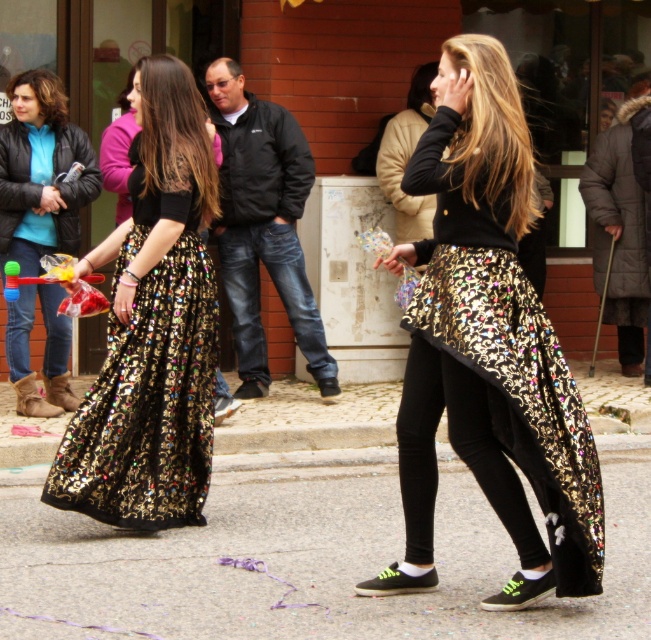
You are a photographer standing at the edge of the street where the shiny asphalt pavement at center is located. You want to take a photo of the festive scene but need to stay 5 meters away from the pavement to avoid disrupting the event. Can you safely take the photo from your current position?

The shiny asphalt pavement at center is 4.52 meters away from the viewer. Since you need to stay 5 meters away, you are currently too close and should move back 0.48 meters to comply with the requirement.

You are a photographer trying to capture both the shiny sequined skirt at center and the shiny metallic skirt at left in a single frame. Which skirt should you focus on first to ensure both are in the frame?

You should focus on the shiny metallic skirt at left first because it is positioned to the left of the shiny sequined skirt at center, allowing you to frame both skirts from left to right.